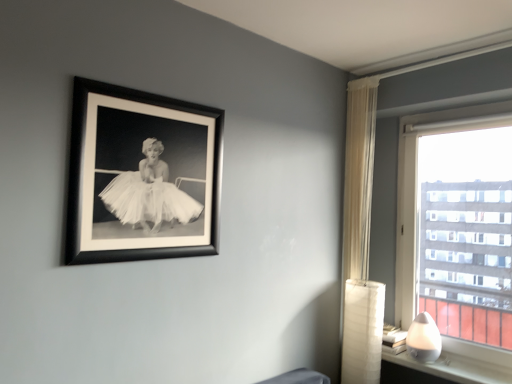
Question: From a real-world perspective, does sheer white curtain at right stand above white glossy lamp at lower right?

Choices:
 (A) yes
 (B) no

Answer: (A)

Question: Is sheer white curtain at right taller than white glossy lamp at lower right?

Choices:
 (A) no
 (B) yes

Answer: (B)

Question: Is sheer white curtain at right facing towards white glossy lamp at lower right?

Choices:
 (A) yes
 (B) no

Answer: (B)

Question: Is sheer white curtain at right at the left side of white glossy lamp at lower right?

Choices:
 (A) no
 (B) yes

Answer: (B)

Question: Would you say white glossy lamp at lower right is part of sheer white curtain at right's contents?

Choices:
 (A) yes
 (B) no

Answer: (B)

Question: Based on their positions, is white glossy table lamp at lower right located to the left or right of sheer white curtain at right?

Choices:
 (A) right
 (B) left

Answer: (A)

Question: Considering the positions of white glossy table lamp at lower right and sheer white curtain at right in the image, is white glossy table lamp at lower right wider or thinner than sheer white curtain at right?

Choices:
 (A) wide
 (B) thin

Answer: (A)

Question: Which is correct: white glossy table lamp at lower right is inside sheer white curtain at right, or outside of it?

Choices:
 (A) outside
 (B) inside

Answer: (A)

Question: Is white glossy table lamp at lower right in front of or behind sheer white curtain at right in the image?

Choices:
 (A) behind
 (B) front

Answer: (B)

Question: Is black matte picture frame at upper left taller or shorter than transparent glass window at right?

Choices:
 (A) short
 (B) tall

Answer: (A)

Question: Is black matte picture frame at upper left in front of or behind transparent glass window at right in the image?

Choices:
 (A) behind
 (B) front

Answer: (B)

Question: Based on their sizes in the image, would you say black matte picture frame at upper left is bigger or smaller than transparent glass window at right?

Choices:
 (A) big
 (B) small

Answer: (B)

Question: From the image's perspective, is black matte picture frame at upper left above or below transparent glass window at right?

Choices:
 (A) above
 (B) below

Answer: (A)

Question: Would you say sheer white curtain at right is to the left or to the right of white glossy table lamp at lower right in the picture?

Choices:
 (A) left
 (B) right

Answer: (A)

Question: From the image's perspective, relative to white glossy table lamp at lower right, is sheer white curtain at right above or below?

Choices:
 (A) above
 (B) below

Answer: (A)